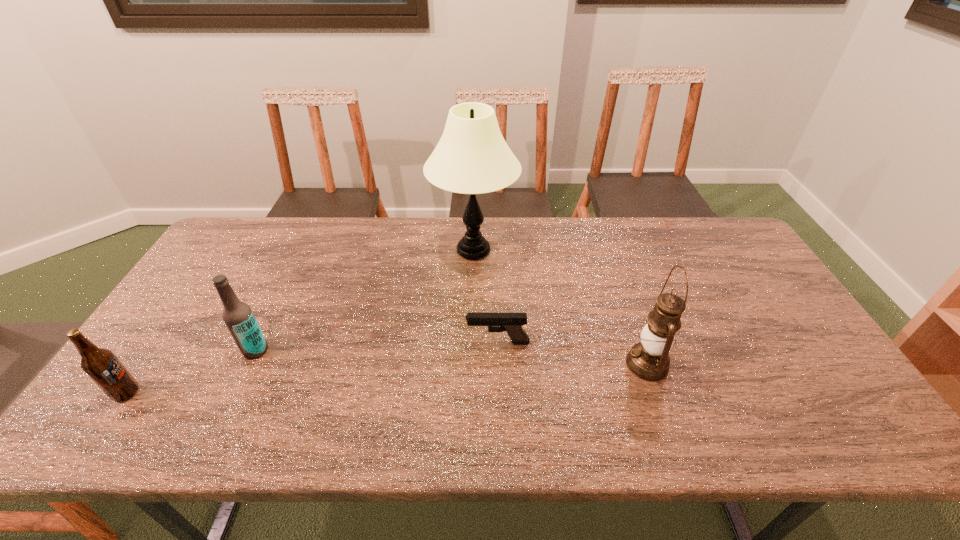
In the image, there is a desktop. In order to click on vacant space at the right edge in this screenshot , I will do point(755,323).

Image resolution: width=960 pixels, height=540 pixels. Identify the location of vacant space at the far left corner of the desktop. (240, 248).

Find the location of a particular element. vacant space at the far right corner is located at coordinates (730, 233).

You are a GUI agent. You are given a task and a screenshot of the screen. Output one action in this format:
    pyautogui.click(x=<x>, y=<y>)
    Task: Click on the vacant area at the near right corner
    The image size is (960, 540).
    Given the screenshot: What is the action you would take?
    pyautogui.click(x=848, y=412)

Image resolution: width=960 pixels, height=540 pixels. What are the coordinates of `vacant space in between the second tallest object and the right beer bottle` in the screenshot? It's located at (451, 357).

Locate an element on the screen. vacant area between the leftmost object and the fourth object from right to left is located at coordinates (191, 372).

Locate an element on the screen. vacant space that is in between the fourth tallest object and the rightmost object is located at coordinates (387, 379).

The height and width of the screenshot is (540, 960). In order to click on free space between the pistol and the lamp in this screenshot , I will do `click(486, 296)`.

This screenshot has width=960, height=540. What are the coordinates of `vacant space in between the shortest object and the rightmost object` in the screenshot? It's located at (572, 353).

Identify the location of free spot between the shortest object and the farther beer bottle. (376, 346).